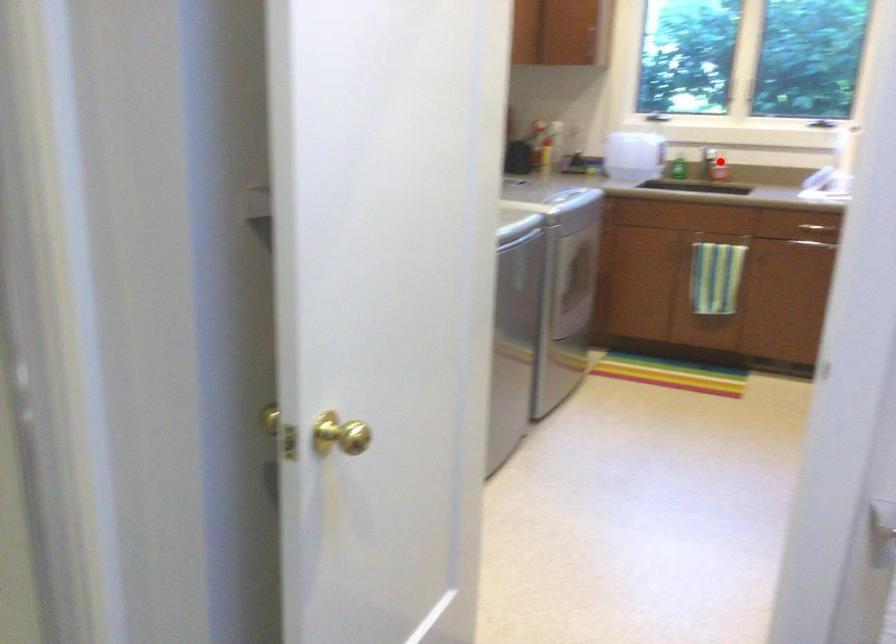
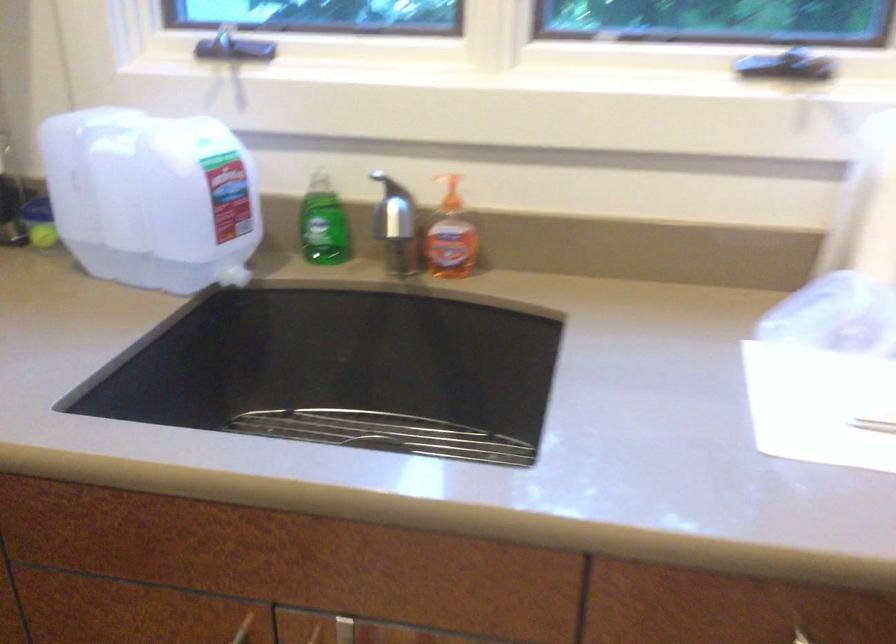
Question: A red point is marked in image1. In image2, is the corresponding 3D point closer to the camera or farther? Reply with the corresponding letter.

Choices:
 (A) The corresponding 3D point is closer.
 (B) The corresponding 3D point is farther.

Answer: (A)